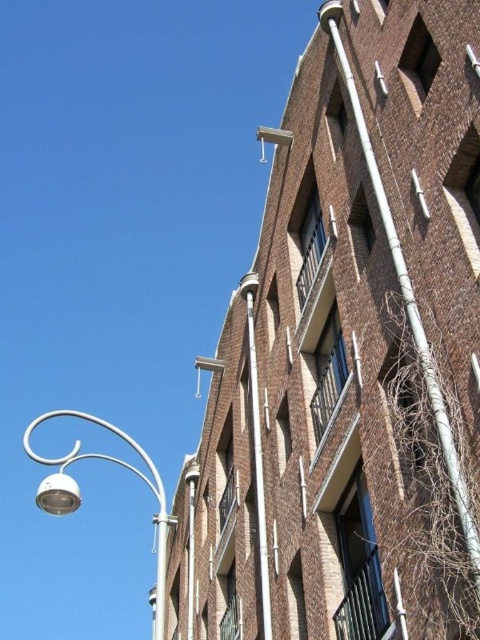
Which is behind, point (79, 444) or point (253, 476)?

The point (79, 444) is behind.

The width and height of the screenshot is (480, 640). I want to click on metallic silver streetlight at lower left, so click(81, 499).

Describe the element at coordinates (256, 454) in the screenshot. The height and width of the screenshot is (640, 480). I see `metallic silver pole at center` at that location.

Image resolution: width=480 pixels, height=640 pixels. What are the coordinates of `metallic silver pole at center` in the screenshot? It's located at (256, 454).

Does metallic silver streetlight at lower left appear on the right side of metallic pipe at upper center?

No, metallic silver streetlight at lower left is not to the right of metallic pipe at upper center.

At what (x,y) coordinates should I click in order to perform the action: click on metallic silver streetlight at lower left. Please return your answer as a coordinate pair (x, y). The width and height of the screenshot is (480, 640). Looking at the image, I should click on (81, 499).

Is point (164, 580) in front of point (187, 484)?

Yes, point (164, 580) is in front of point (187, 484).

I want to click on metallic silver streetlight at lower left, so click(81, 499).